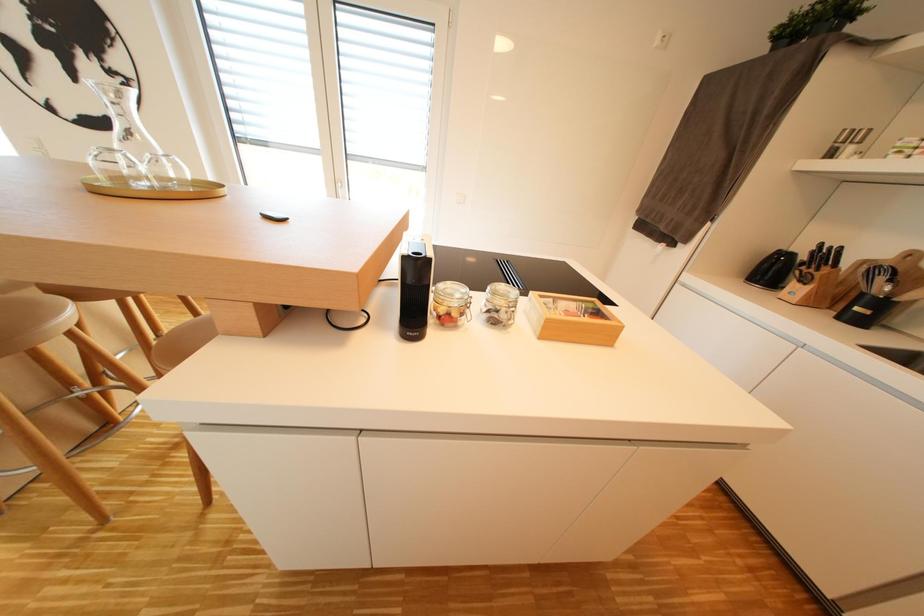
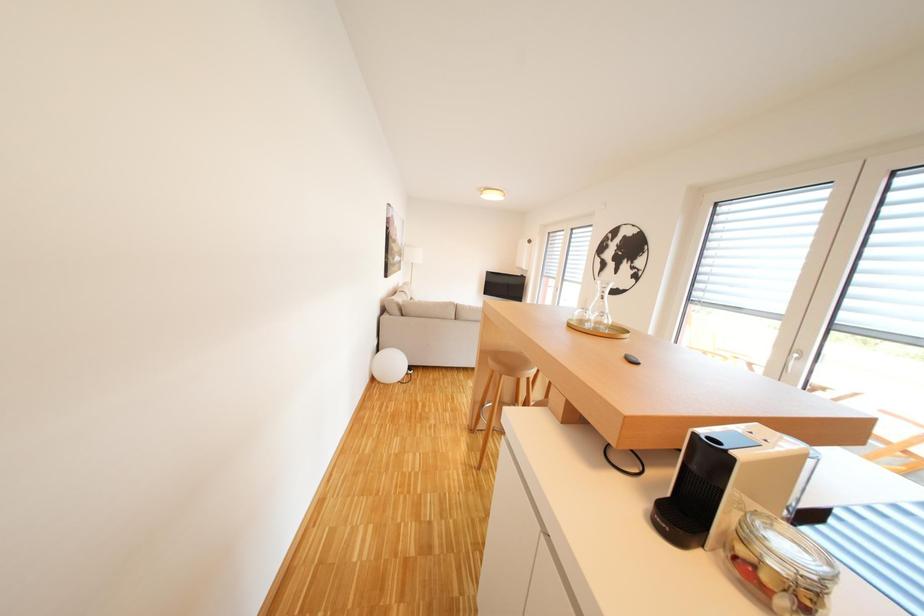
Question: The camera is either moving clockwise (left) or counter-clockwise (right) around the object. The first image is from the beginning of the video and the second image is from the end. Is the camera moving left or right when shooting the video?

Choices:
 (A) Left
 (B) Right

Answer: (B)